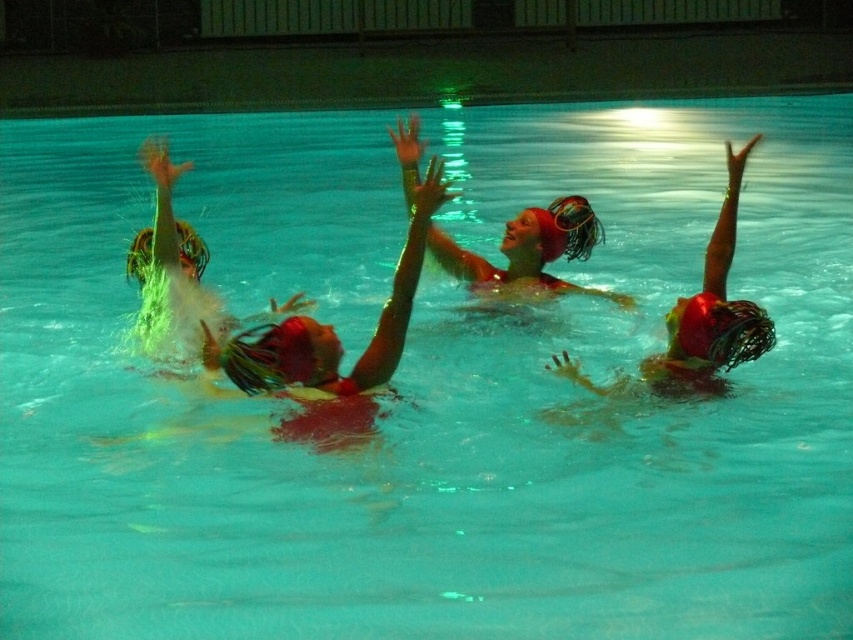
Question: Can you confirm if matte red swimsuit at center is positioned below matte red swim cap at center?

Choices:
 (A) no
 (B) yes

Answer: (B)

Question: Which point is farther to the camera?

Choices:
 (A) (651, 387)
 (B) (380, 317)
 (C) (717, 262)

Answer: (C)

Question: Estimate the real-world distances between objects in this image. Which object is closer to the green matte hair at upper right?

Choices:
 (A) shiny red swimsuit at right
 (B) matte red swimsuit at center
 (C) matte red swim cap at center

Answer: (A)

Question: Does shiny red swimsuit at right appear over matte red swim cap at center?

Choices:
 (A) no
 (B) yes

Answer: (B)

Question: Which object is the farthest from the matte red swimsuit at center?

Choices:
 (A) matte red swim cap at center
 (B) green matte hair at upper right
 (C) shiny red swimsuit at right

Answer: (B)

Question: Does matte red swimsuit at center appear over matte red swim cap at center?

Choices:
 (A) no
 (B) yes

Answer: (A)